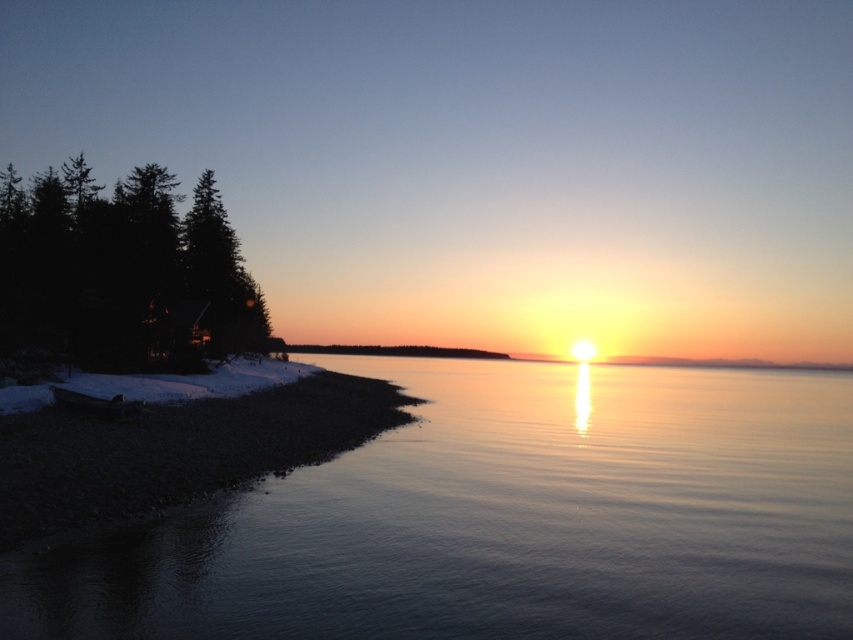
Is smooth reflective water at center smaller than dark green textured trees at left?

Yes, smooth reflective water at center is smaller than dark green textured trees at left.

Does point (564, 417) come behind point (39, 236)?

No.

Locate an element on the screen. The image size is (853, 640). smooth reflective water at center is located at coordinates point(503,520).

Who is more distant from viewer, (x=166, y=296) or (x=221, y=451)?

The point (x=166, y=296) is more distant.

Does dark green textured trees at left have a larger size compared to smooth gravel shoreline at lower left?

Yes.

The image size is (853, 640). I want to click on dark green textured trees at left, so click(x=123, y=273).

The width and height of the screenshot is (853, 640). What are the coordinates of `smooth reflective water at center` in the screenshot? It's located at (503, 520).